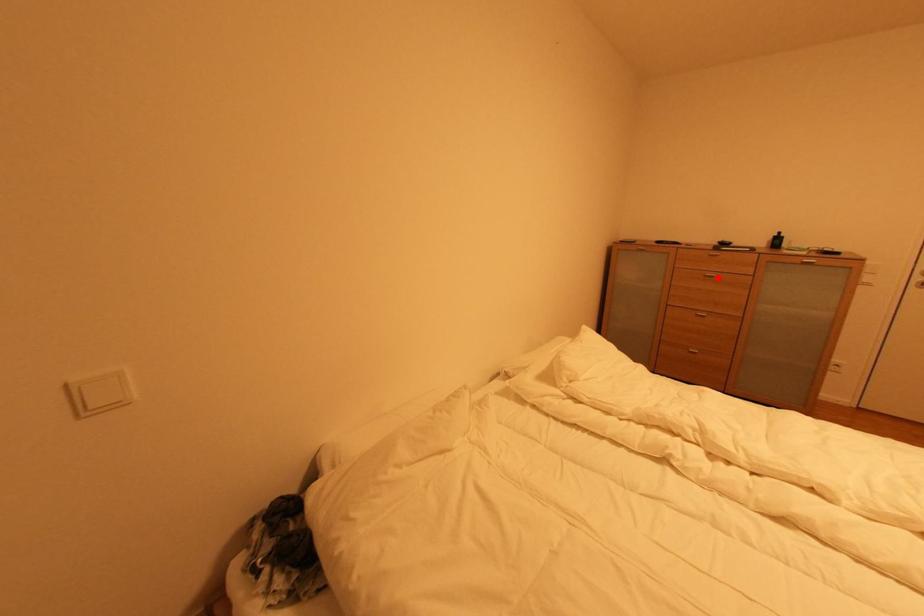
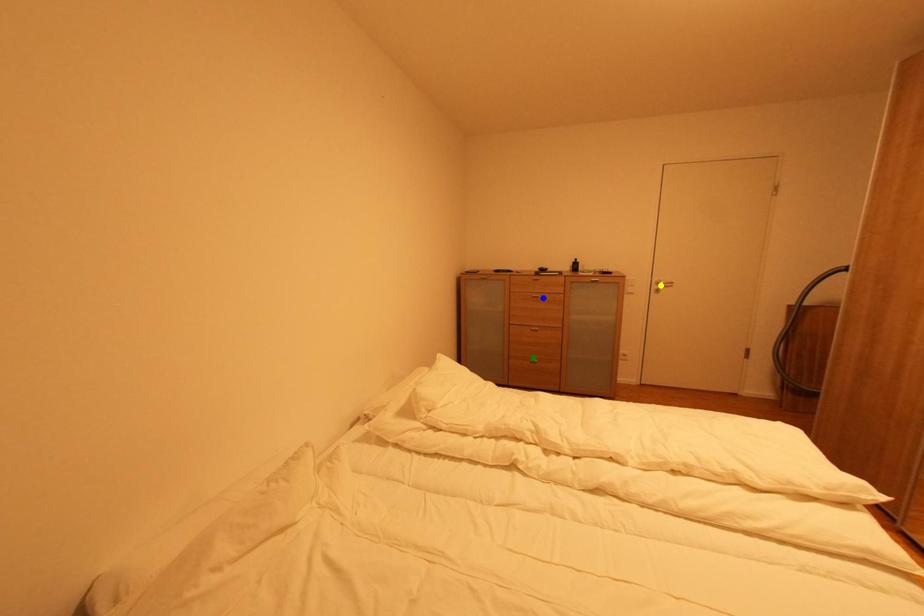
Question: I am providing you with two images of the same scene from different viewpoints. A red point is marked on the first image. You are given multiple points on the second image. In image 2, which mark is for the same physical point as the one in image 1?

Choices:
 (A) yellow point
 (B) green point
 (C) blue point

Answer: (C)